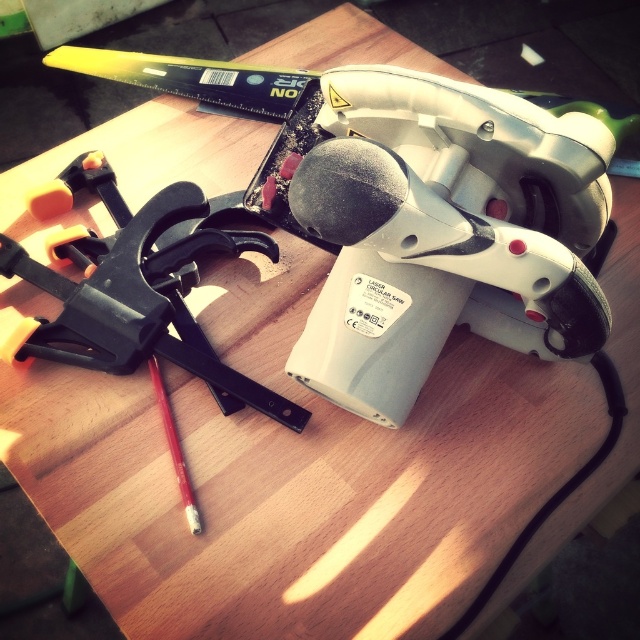
Question: Is black plastic clamp at upper left to the right of red wood pencil at center from the viewer's perspective?

Choices:
 (A) no
 (B) yes

Answer: (A)

Question: From the image, what is the correct spatial relationship of black plastic clamp at upper left in relation to red wood pencil at center?

Choices:
 (A) left
 (B) right

Answer: (A)

Question: Can you confirm if black plastic clamp at upper left is positioned below red wood pencil at center?

Choices:
 (A) yes
 (B) no

Answer: (B)

Question: Which point is closer to the camera taking this photo?

Choices:
 (A) (104, 307)
 (B) (196, 528)

Answer: (B)

Question: Which object appears closest to the camera in this image?

Choices:
 (A) red wood pencil at center
 (B) black plastic clamp at upper left

Answer: (A)

Question: Which point is farther from the camera taking this photo?

Choices:
 (A) (172, 445)
 (B) (125, 256)

Answer: (B)